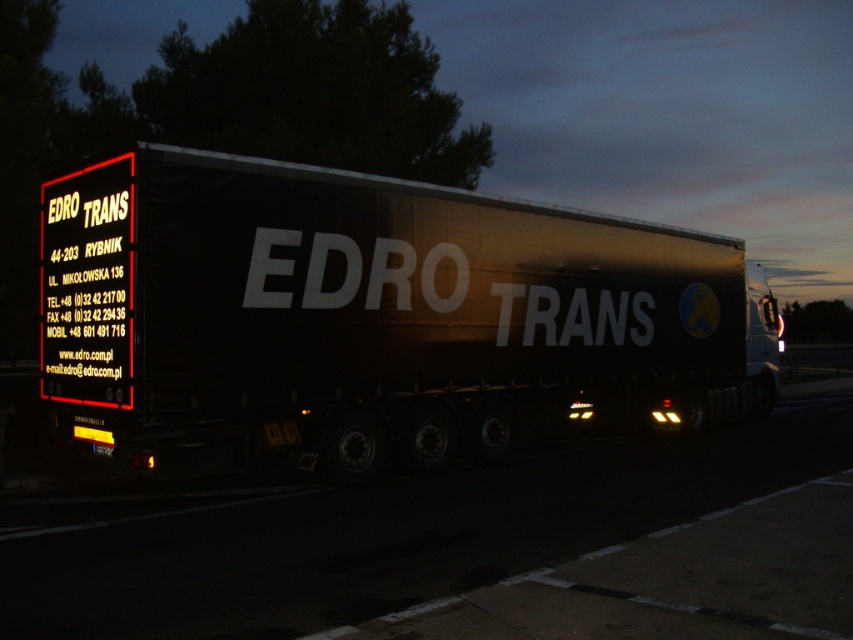
Can you confirm if glossy black trailer at center is positioned to the left of black matte sign at upper left?

In fact, glossy black trailer at center is to the right of black matte sign at upper left.

Is point (457, 172) closer to camera compared to point (128, 298)?

No, (457, 172) is behind (128, 298).

Which is behind, point (634, 70) or point (80, 193)?

Point (634, 70)

Locate an element on the screen. This screenshot has height=640, width=853. glossy black trailer at center is located at coordinates (463, 109).

Is metallic silver trailer at center to the right of glossy black trailer at center from the viewer's perspective?

No, metallic silver trailer at center is not to the right of glossy black trailer at center.

Who is more forward, (56, 371) or (514, 193)?

Positioned in front is point (56, 371).

Identify the location of metallic silver trailer at center. The width and height of the screenshot is (853, 640). (370, 316).

In the scene shown: Who is shorter, metallic silver trailer at center or black matte sign at upper left?

black matte sign at upper left

This screenshot has width=853, height=640. I want to click on metallic silver trailer at center, so click(370, 316).